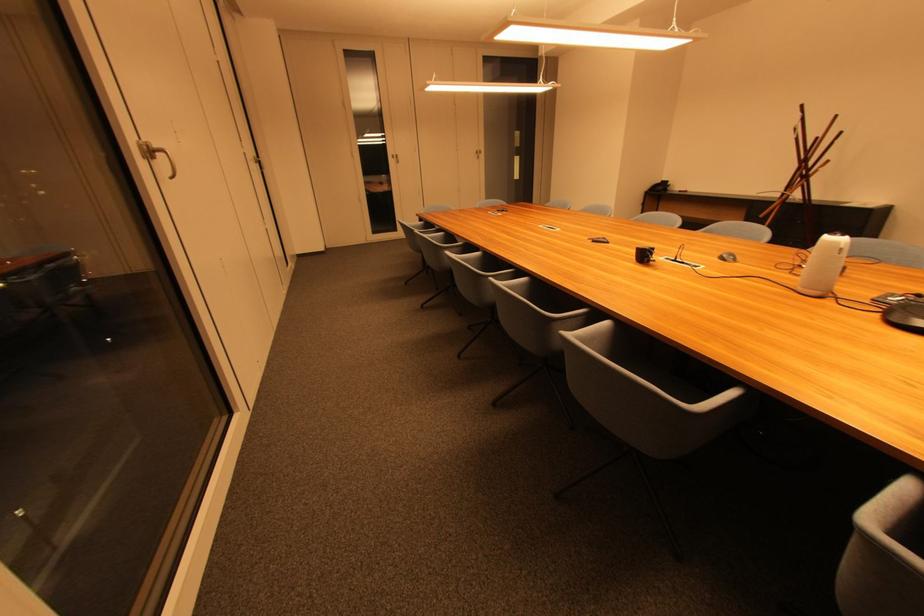
Image resolution: width=924 pixels, height=616 pixels. What are the coordinates of `white cabinet handle` in the screenshot? It's located at (259, 163).